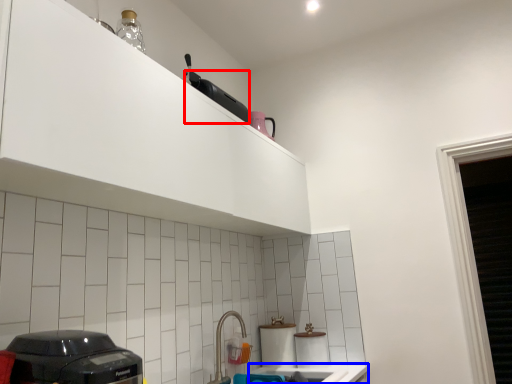
Question: Among these objects, which one is nearest to the camera, appliance (highlighted by a red box) or counter top (highlighted by a blue box)?

Choices:
 (A) appliance
 (B) counter top

Answer: (B)